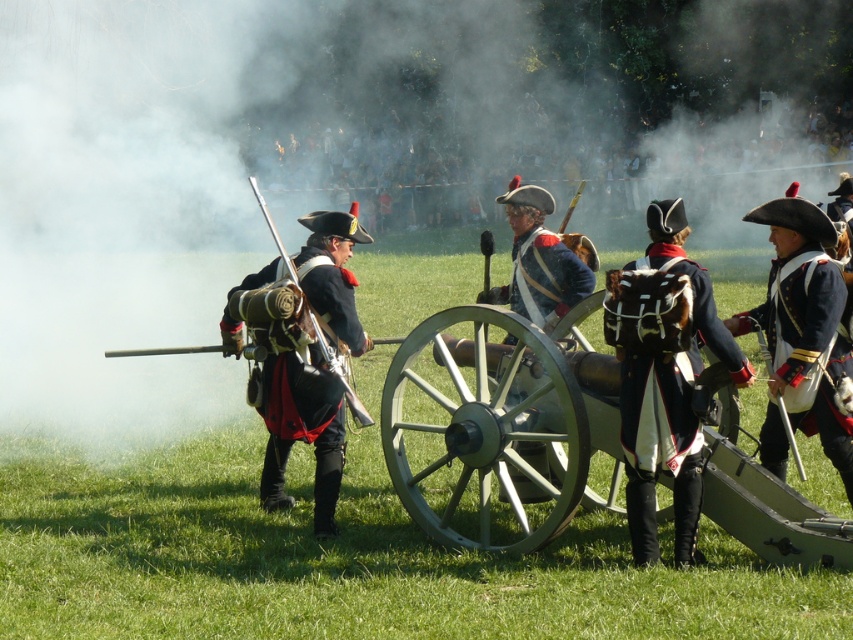
Question: Among these objects, which one is nearest to the camera?

Choices:
 (A) green wooden cannon at center
 (B) shiny blue fabric uniform at right
 (C) smoke at center
 (D) black leather uniform at center

Answer: (A)

Question: Does smoke at center have a larger size compared to shiny blue fabric uniform at right?

Choices:
 (A) yes
 (B) no

Answer: (A)

Question: Does smoke at center appear under black leather uniform at center?

Choices:
 (A) no
 (B) yes

Answer: (A)

Question: Does green wooden cannon at center have a lesser width compared to dark blue fabric uniform at center?

Choices:
 (A) yes
 (B) no

Answer: (B)

Question: Which point appears farthest from the camera in this image?

Choices:
 (A) (457, 109)
 (B) (421, 442)
 (C) (801, 422)

Answer: (A)

Question: Which of the following is the farthest from the observer?

Choices:
 (A) (614, 470)
 (B) (109, 381)

Answer: (B)